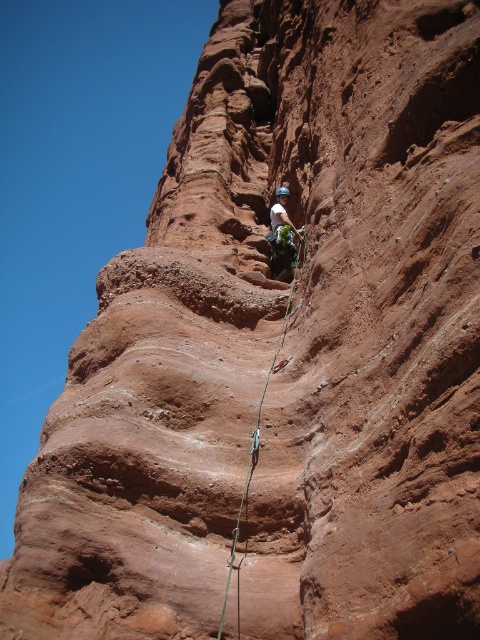
Question: Can you confirm if green nylon rope at center is positioned above matte blue helmet at center?

Choices:
 (A) yes
 (B) no

Answer: (B)

Question: Which object appears farthest from the camera in this image?

Choices:
 (A) matte blue helmet at center
 (B) green nylon rope at center

Answer: (A)

Question: Among these points, which one is nearest to the camera?

Choices:
 (A) (294, 285)
 (B) (287, 193)

Answer: (A)

Question: Is green nylon rope at center to the left of matte blue helmet at center from the viewer's perspective?

Choices:
 (A) no
 (B) yes

Answer: (B)

Question: Does green nylon rope at center have a smaller size compared to matte blue helmet at center?

Choices:
 (A) yes
 (B) no

Answer: (B)